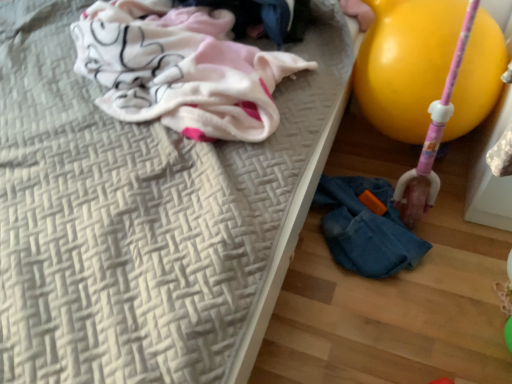
Question: Considering the relative sizes of denim jacket at lower right and white cotton cloth at upper left in the image provided, is denim jacket at lower right taller than white cotton cloth at upper left?

Choices:
 (A) yes
 (B) no

Answer: (B)

Question: Does denim jacket at lower right have a lesser height compared to white cotton cloth at upper left?

Choices:
 (A) no
 (B) yes

Answer: (B)

Question: Considering the relative sizes of denim jacket at lower right and white cotton cloth at upper left in the image provided, is denim jacket at lower right thinner than white cotton cloth at upper left?

Choices:
 (A) no
 (B) yes

Answer: (B)

Question: From the image's perspective, is denim jacket at lower right beneath white cotton cloth at upper left?

Choices:
 (A) no
 (B) yes

Answer: (B)

Question: Can you confirm if denim jacket at lower right is wider than white cotton cloth at upper left?

Choices:
 (A) yes
 (B) no

Answer: (B)

Question: Are denim jacket at lower right and white cotton cloth at upper left far apart?

Choices:
 (A) no
 (B) yes

Answer: (A)

Question: Would you consider yellow rubber balloon at right to be distant from denim jacket at lower right?

Choices:
 (A) yes
 (B) no

Answer: (B)

Question: From a real-world perspective, is yellow rubber balloon at right physically above denim jacket at lower right?

Choices:
 (A) yes
 (B) no

Answer: (A)

Question: Is yellow rubber balloon at right closer to the viewer compared to denim jacket at lower right?

Choices:
 (A) yes
 (B) no

Answer: (A)

Question: Is yellow rubber balloon at right outside of denim jacket at lower right?

Choices:
 (A) no
 (B) yes

Answer: (B)

Question: Is yellow rubber balloon at right thinner than denim jacket at lower right?

Choices:
 (A) yes
 (B) no

Answer: (A)

Question: Is yellow rubber balloon at right shorter than denim jacket at lower right?

Choices:
 (A) no
 (B) yes

Answer: (A)

Question: From the image's perspective, is denim jacket at lower right on top of yellow rubber balloon at right?

Choices:
 (A) yes
 (B) no

Answer: (B)